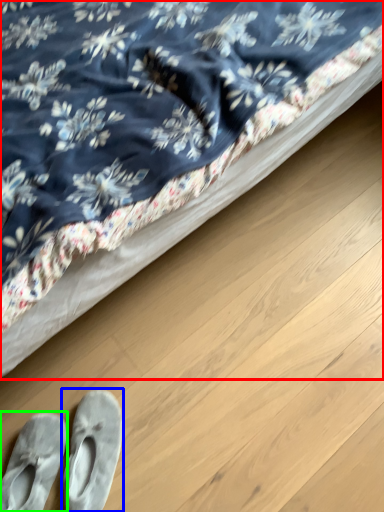
Question: Based on their relative distances, which object is nearer to bed (highlighted by a red box)? Choose from footwear (highlighted by a blue box) and footwear (highlighted by a green box).

Choices:
 (A) footwear
 (B) footwear

Answer: (A)